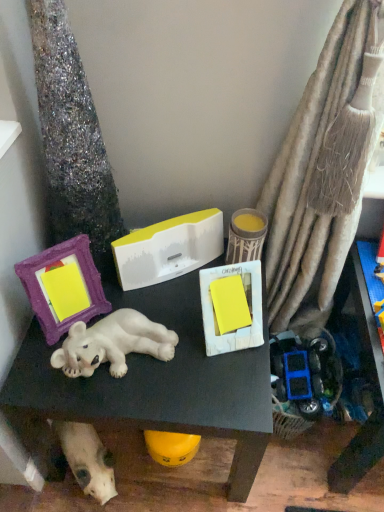
Question: Can you confirm if purple fabric picture frame at left is wider than matte yellow candle at center?

Choices:
 (A) no
 (B) yes

Answer: (A)

Question: Does purple fabric picture frame at left have a larger size compared to matte yellow candle at center?

Choices:
 (A) yes
 (B) no

Answer: (A)

Question: Is purple fabric picture frame at left at the left side of matte yellow candle at center?

Choices:
 (A) yes
 (B) no

Answer: (A)

Question: Considering the relative sizes of purple fabric picture frame at left and matte yellow candle at center in the image provided, is purple fabric picture frame at left taller than matte yellow candle at center?

Choices:
 (A) no
 (B) yes

Answer: (B)

Question: Considering the relative sizes of purple fabric picture frame at left and matte yellow candle at center in the image provided, is purple fabric picture frame at left thinner than matte yellow candle at center?

Choices:
 (A) no
 (B) yes

Answer: (B)

Question: From a real-world perspective, does purple fabric picture frame at left sit lower than matte yellow candle at center?

Choices:
 (A) no
 (B) yes

Answer: (A)

Question: Considering the relative sizes of sparkly silver tree trunk at left and white matte dog at lower left in the image provided, is sparkly silver tree trunk at left shorter than white matte dog at lower left?

Choices:
 (A) yes
 (B) no

Answer: (B)

Question: Can you confirm if sparkly silver tree trunk at left is positioned to the left of white matte dog at lower left?

Choices:
 (A) yes
 (B) no

Answer: (B)

Question: From the image's perspective, is sparkly silver tree trunk at left on white matte dog at lower left?

Choices:
 (A) yes
 (B) no

Answer: (A)

Question: Can you confirm if sparkly silver tree trunk at left is bigger than white matte dog at lower left?

Choices:
 (A) yes
 (B) no

Answer: (A)

Question: Is sparkly silver tree trunk at left turned away from white matte dog at lower left?

Choices:
 (A) yes
 (B) no

Answer: (B)

Question: From the image's perspective, is sparkly silver tree trunk at left below white matte dog at lower left?

Choices:
 (A) yes
 (B) no

Answer: (B)

Question: Does white glossy polar bear at center have a greater height compared to purple fabric picture frame at left?

Choices:
 (A) no
 (B) yes

Answer: (B)